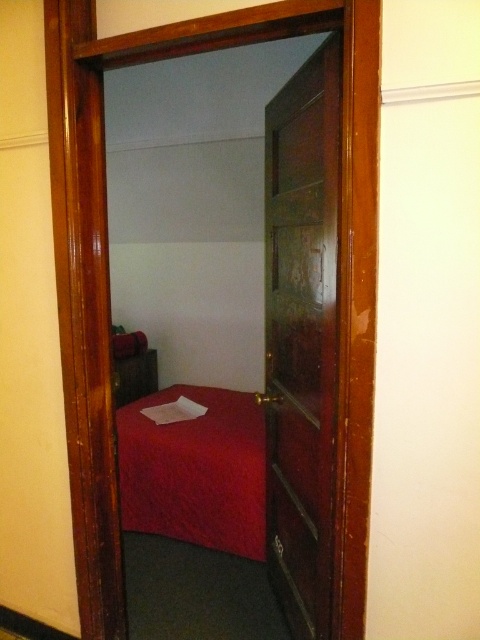
You are standing in the hallway and want to enter the room through the mahogany wood door at center. What are the coordinates of the door to guide you?

Result: The coordinates of the mahogany wood door at center are at point (x=301, y=337).

What is the spatial relationship between the mahogany wood door at center and the matte red bed at center as seen through the doorway?

The mahogany wood door at center is to the right of the matte red bed at center.

You are standing in the hallway outside the room shown in the image. You want to enter the room to retrieve a book from the shelf behind the bed. Can you walk through the space between the mahogany wood door at center and the matte red bed at center to reach the shelf?

The mahogany wood door at center is in front of the matte red bed at center, meaning the door blocks direct access to the bed. To reach the shelf behind the bed, you would need to enter the room through the door and then move around the bed.